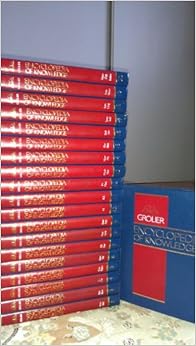
Find the location of a particular element. The width and height of the screenshot is (196, 346). book titles in gold letters is located at coordinates (42, 171), (39, 156), (43, 240), (41, 266), (39, 278), (38, 289), (55, 115), (42, 68).